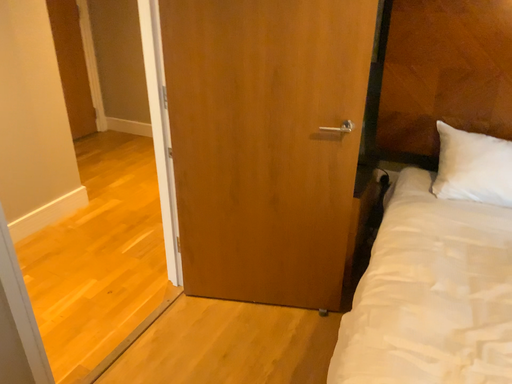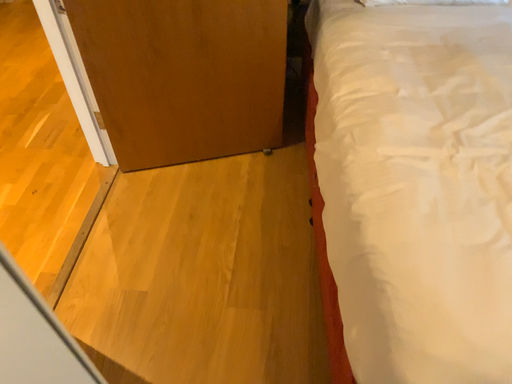
Question: Which way did the camera rotate in the video?

Choices:
 (A) rotated left
 (B) rotated right

Answer: (B)